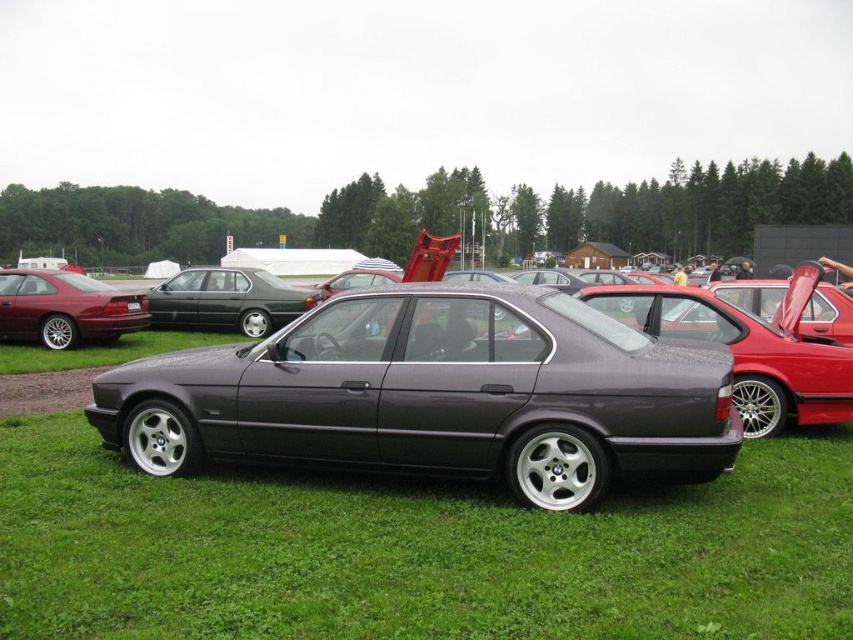
Is satin metallic sedan at center behind satin black sedan at center?

That is False.

Can you confirm if satin metallic sedan at center is taller than satin black sedan at center?

In fact, satin metallic sedan at center may be shorter than satin black sedan at center.

Is point (657, 358) farther from viewer compared to point (219, 298)?

No, (657, 358) is closer to viewer.

Identify the location of satin metallic sedan at center. (436, 394).

Describe the element at coordinates (436, 394) in the screenshot. I see `satin metallic sedan at center` at that location.

Describe the element at coordinates (436, 394) in the screenshot. This screenshot has height=640, width=853. I see `satin metallic sedan at center` at that location.

Identify the location of satin metallic sedan at center. (436, 394).

Can you confirm if shiny red car at left is smaller than satin black sedan at center?

Indeed, shiny red car at left has a smaller size compared to satin black sedan at center.

The image size is (853, 640). Describe the element at coordinates (65, 308) in the screenshot. I see `shiny red car at left` at that location.

This screenshot has width=853, height=640. Identify the location of shiny red car at left. (65, 308).